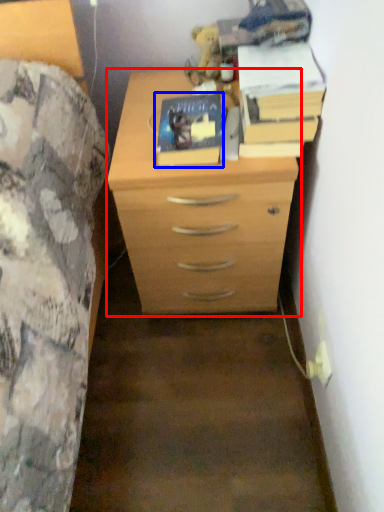
Question: Which of the following is the farthest to the observer, chest of drawers (highlighted by a red box) or paperback book (highlighted by a blue box)?

Choices:
 (A) chest of drawers
 (B) paperback book

Answer: (B)